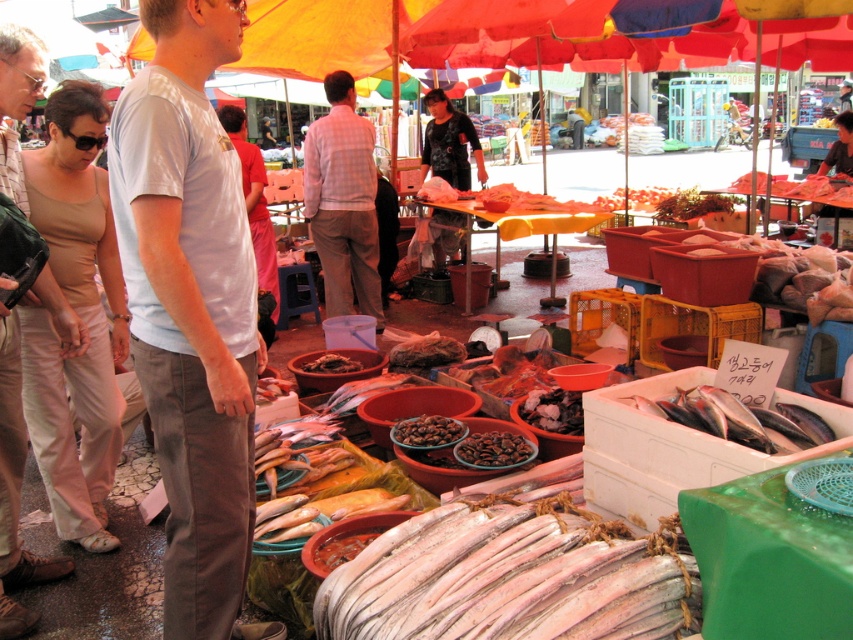
Question: Can you confirm if shiny silver fish at center is positioned below brown matte beans at center?

Choices:
 (A) no
 (B) yes

Answer: (A)

Question: Does light gray cotton shirt at left come in front of brown matte coffee beans at center?

Choices:
 (A) no
 (B) yes

Answer: (B)

Question: Which of the following is the farthest from the observer?

Choices:
 (A) (15, 134)
 (B) (735, 417)
 (C) (166, 456)

Answer: (A)

Question: Can you confirm if shiny silver fish at center is positioned to the left of black matte dried mushrooms at center?

Choices:
 (A) no
 (B) yes

Answer: (A)

Question: Which object appears farthest from the camera in this image?

Choices:
 (A) shiny silver fish at center
 (B) brown textured fish at center
 (C) brown matte dried fish at center

Answer: (B)

Question: Which point is farther to the camera?

Choices:
 (A) (469, 452)
 (B) (370, 124)

Answer: (B)